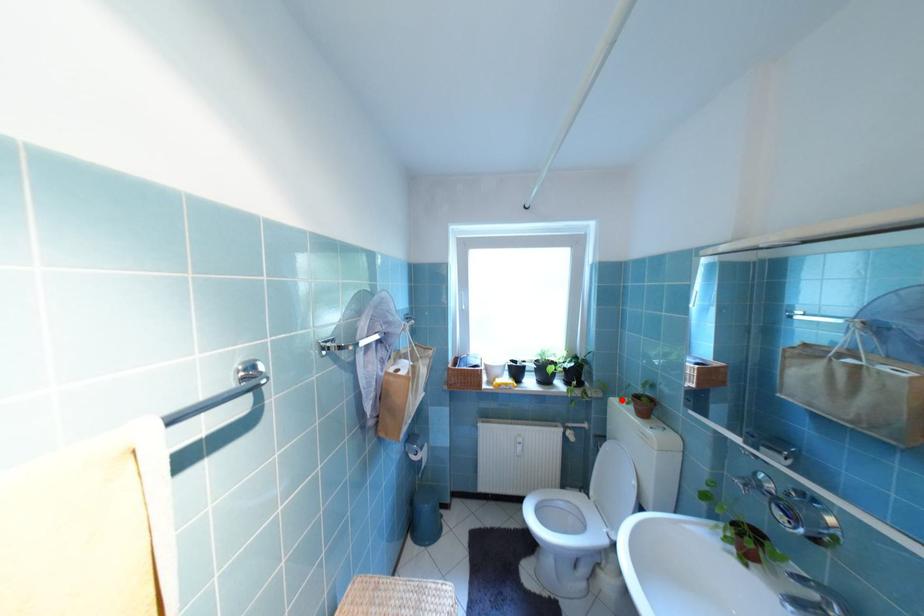
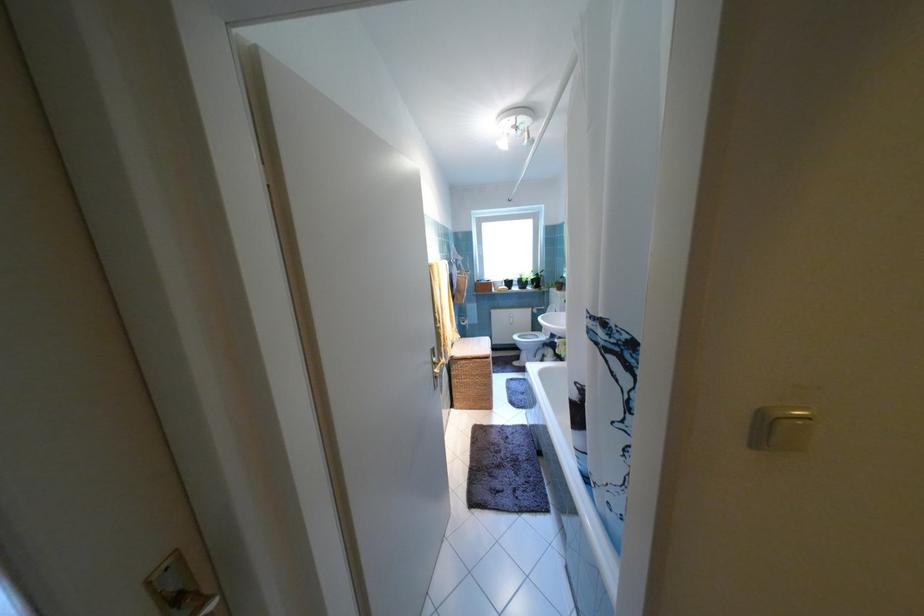
Question: I am providing you with two images of the same scene from different viewpoints. Given a red point in image1, look at the same physical point in image2. Is it:

Choices:
 (A) Closer to the viewpoint
 (B) Farther from the viewpoint

Answer: (A)